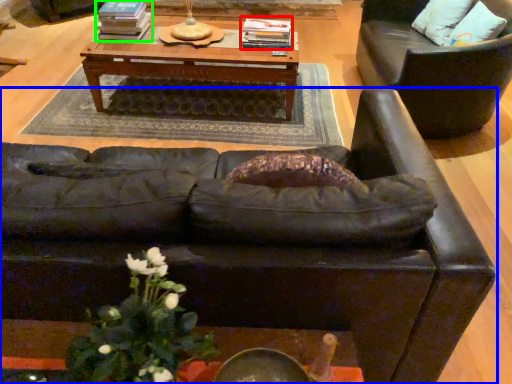
Question: Which object is the closest to the book (highlighted by a red box)? Choose among these: studio couch (highlighted by a blue box) or book (highlighted by a green box).

Choices:
 (A) studio couch
 (B) book

Answer: (B)